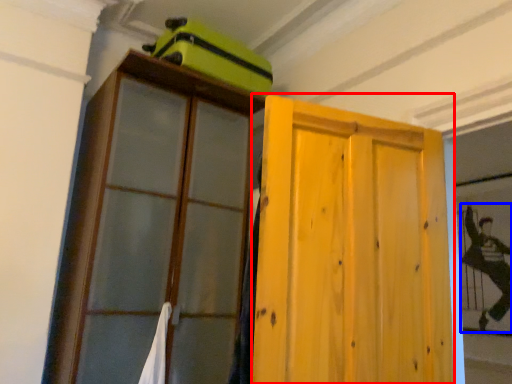
Question: Among these objects, which one is nearest to the camera, door (highlighted by a red box) or couple (highlighted by a blue box)?

Choices:
 (A) door
 (B) couple

Answer: (A)